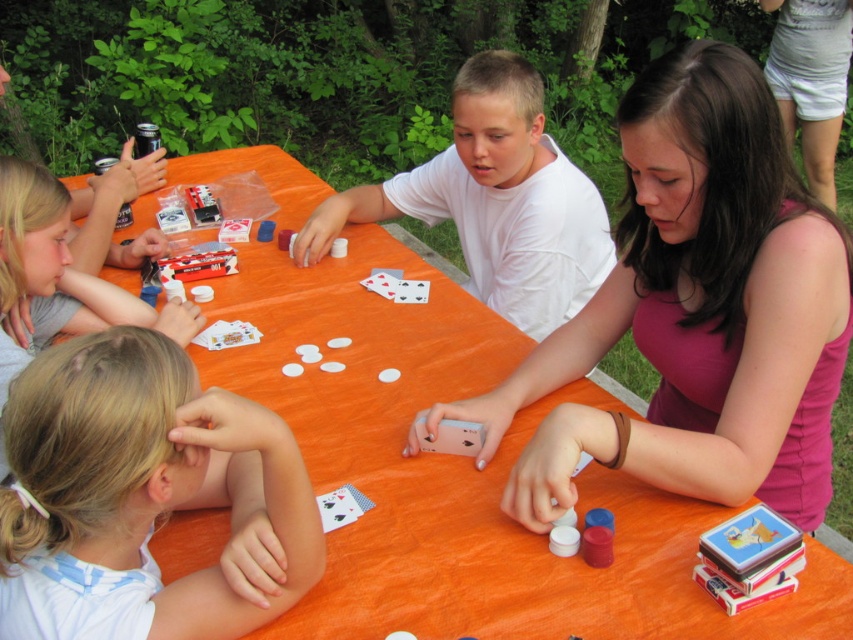
Question: In this image, where is white matte shirt at center located relative to smooth plastic cards at upper left?

Choices:
 (A) left
 (B) right

Answer: (B)

Question: Estimate the real-world distances between objects in this image. Which object is closer to the pink matte tank top at center?

Choices:
 (A) white matte shirt at center
 (B) smooth plastic cards at upper left

Answer: (A)

Question: Can you confirm if pink matte tank top at center is smaller than smooth plastic cards at upper left?

Choices:
 (A) yes
 (B) no

Answer: (B)

Question: Observing the image, what is the correct spatial positioning of blonde hair at left in reference to white matte shirt at center?

Choices:
 (A) above
 (B) below

Answer: (B)

Question: Among these points, which one is farthest from the camera?

Choices:
 (A) (181, 308)
 (B) (740, 364)
 (C) (514, 244)

Answer: (C)

Question: Estimate the real-world distances between objects in this image. Which object is farther from the smooth plastic cards at upper left?

Choices:
 (A) white matte shirt at center
 (B) pink matte tank top at center
 (C) blonde hair at left

Answer: (B)